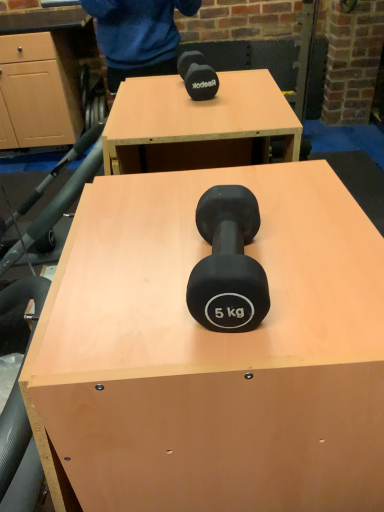
Question: Could matte black dumbbell at center be considered to be inside black rubber dumbbell at center?

Choices:
 (A) no
 (B) yes

Answer: (A)

Question: Considering the relative positions of black rubber dumbbell at center and matte black dumbbell at center in the image provided, is black rubber dumbbell at center behind matte black dumbbell at center?

Choices:
 (A) no
 (B) yes

Answer: (A)

Question: From the image's perspective, does black rubber dumbbell at center appear lower than matte black dumbbell at center?

Choices:
 (A) yes
 (B) no

Answer: (B)

Question: Is black rubber dumbbell at center closer to camera compared to matte black dumbbell at center?

Choices:
 (A) yes
 (B) no

Answer: (A)

Question: Considering the relative sizes of black rubber dumbbell at center and matte black dumbbell at center in the image provided, is black rubber dumbbell at center taller than matte black dumbbell at center?

Choices:
 (A) yes
 (B) no

Answer: (B)

Question: Does black rubber dumbbell at center have a lesser width compared to matte black dumbbell at center?

Choices:
 (A) no
 (B) yes

Answer: (B)

Question: Is matte black dumbbell at center in front of black rubber dumbbell at center?

Choices:
 (A) yes
 (B) no

Answer: (B)

Question: From a real-world perspective, is matte black dumbbell at center located beneath black rubber dumbbell at center?

Choices:
 (A) no
 (B) yes

Answer: (B)

Question: Considering the relative sizes of matte black dumbbell at center and black rubber dumbbell at center in the image provided, is matte black dumbbell at center smaller than black rubber dumbbell at center?

Choices:
 (A) no
 (B) yes

Answer: (A)

Question: Is matte black dumbbell at center thinner than black rubber dumbbell at center?

Choices:
 (A) yes
 (B) no

Answer: (B)

Question: Is matte black dumbbell at center to the left of black rubber dumbbell at center from the viewer's perspective?

Choices:
 (A) yes
 (B) no

Answer: (A)

Question: From a real-world perspective, is matte black dumbbell at center on black rubber dumbbell at center?

Choices:
 (A) yes
 (B) no

Answer: (B)

Question: Considering the positions of matte black dumbbell at center and black rubber dumbbell at center in the image, is matte black dumbbell at center taller or shorter than black rubber dumbbell at center?

Choices:
 (A) short
 (B) tall

Answer: (B)